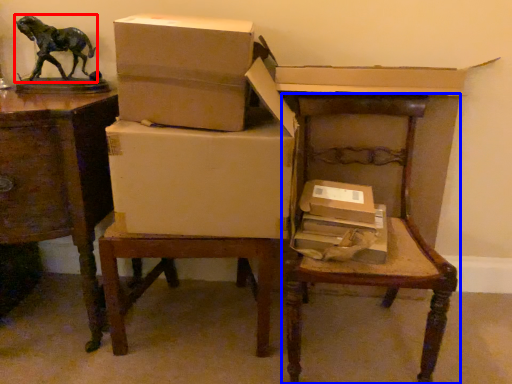
Question: Which object is closer to the camera taking this photo, animal (highlighted by a red box) or chair (highlighted by a blue box)?

Choices:
 (A) animal
 (B) chair

Answer: (B)